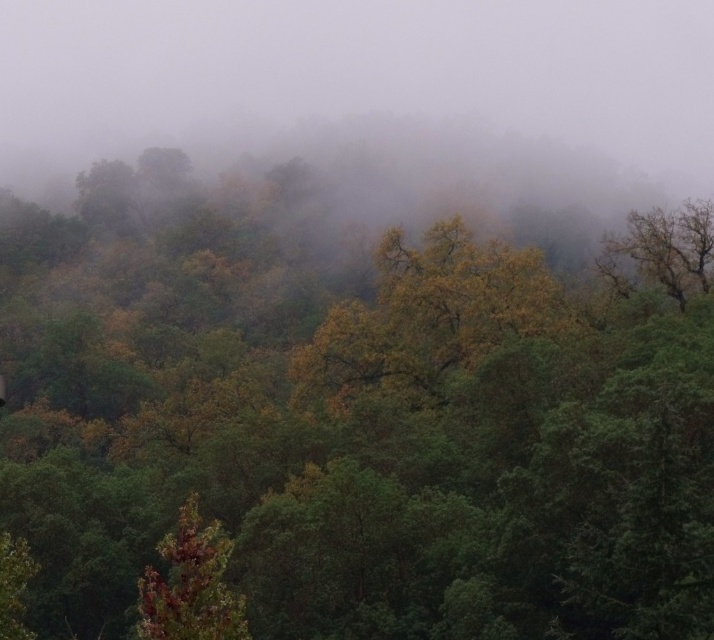
Is foggy atmosphere at center bigger than green leafy tree at upper right?

Indeed, foggy atmosphere at center has a larger size compared to green leafy tree at upper right.

Is point (198, 65) behind point (628, 296)?

That is True.

Where is `foggy atmosphere at center`? This screenshot has width=714, height=640. foggy atmosphere at center is located at coordinates (368, 84).

Is foggy atmosphere at center to the left of brown matte tree at lower left from the viewer's perspective?

Correct, you'll find foggy atmosphere at center to the left of brown matte tree at lower left.

Does foggy atmosphere at center appear under brown matte tree at lower left?

Actually, foggy atmosphere at center is above brown matte tree at lower left.

The height and width of the screenshot is (640, 714). Describe the element at coordinates (368, 84) in the screenshot. I see `foggy atmosphere at center` at that location.

Where is `foggy atmosphere at center`? The height and width of the screenshot is (640, 714). foggy atmosphere at center is located at coordinates (368, 84).

Who is shorter, brown matte tree at lower left or green leafy tree at upper right?

green leafy tree at upper right is shorter.

Who is positioned more to the left, brown matte tree at lower left or green leafy tree at upper right?

From the viewer's perspective, brown matte tree at lower left appears more on the left side.

Which is behind, point (186, 570) or point (630, 262)?

Positioned behind is point (630, 262).

The image size is (714, 640). Identify the location of brown matte tree at lower left. (191, 586).